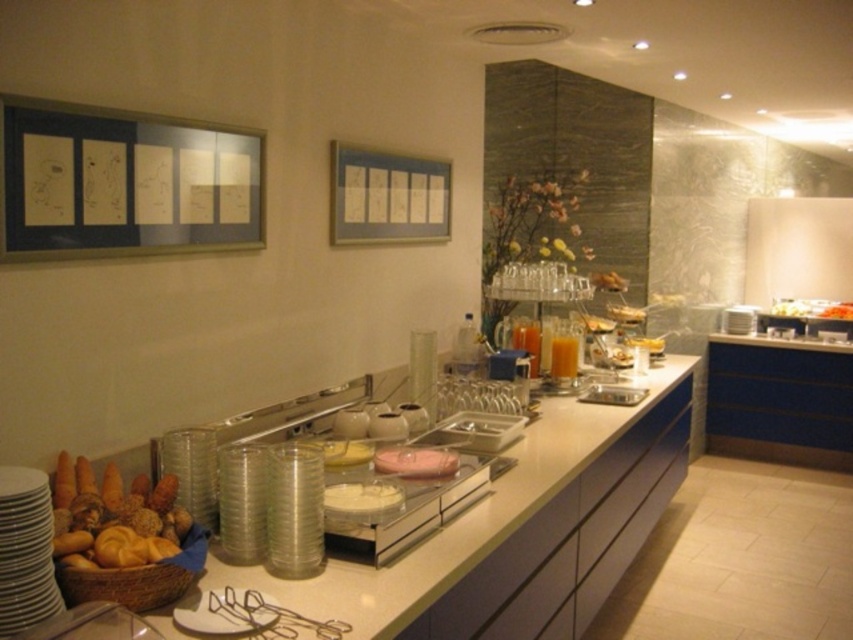
You are a server at the buffet and need to place the translucent plastic containers at center and the orange matte bread at center onto a shelf that can only hold items narrower than 15 cm. Can both items fit on the shelf?

The translucent plastic containers at center has a width less than the orange matte bread at center. However, since the shelf requires items narrower than 15 cm, we need to know the exact width of the orange matte bread at center to determine if both can fit. Unfortunately, the provided information does not specify the exact measurements of either item, only their relative sizes. Therefore, it is impossible to confirm if both items will fit on the shelf based on the given data.